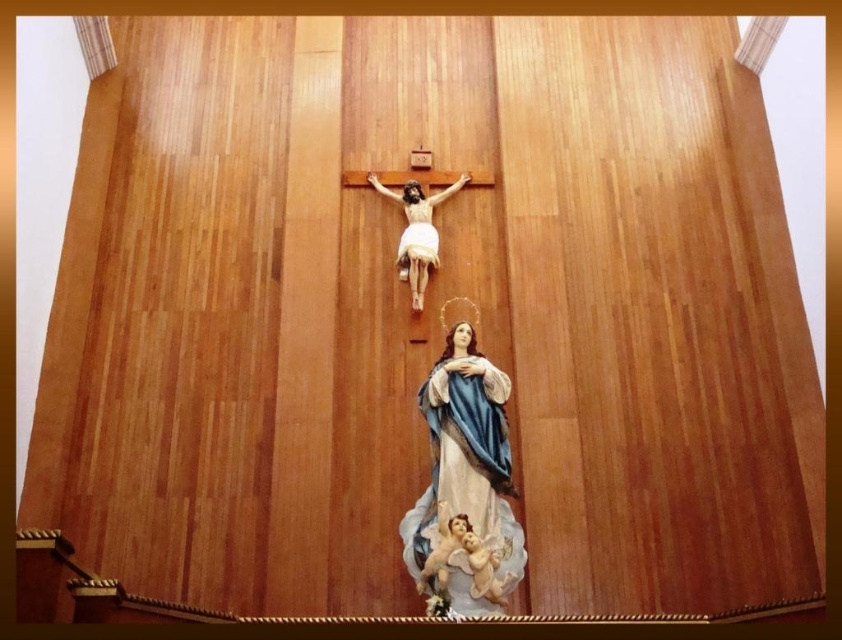
Based on the photo, between polychrome painted statue at center and smooth beige cherub at lower center, which one is positioned lower?

smooth beige cherub at lower center is below.

Who is higher up, polychrome painted statue at center or smooth beige cherub at lower center?

polychrome painted statue at center is above.

Who is more forward, (518, 580) or (514, 576)?

Point (514, 576)

What are the coordinates of `polychrome painted statue at center` in the screenshot? It's located at (465, 484).

Between polychrome painted statue at center and matte white figure at center, which one has more height?

With more height is polychrome painted statue at center.

Who is positioned more to the right, polychrome painted statue at center or matte white figure at center?

Positioned to the right is polychrome painted statue at center.

This screenshot has height=640, width=842. Find the location of `polychrome painted statue at center`. polychrome painted statue at center is located at coordinates (465, 484).

Is polychrome painted statue at center positioned in front of porcelain cherub at lower center?

That is True.

Can you confirm if polychrome painted statue at center is thinner than porcelain cherub at lower center?

No.

What do you see at coordinates (465, 484) in the screenshot?
I see `polychrome painted statue at center` at bounding box center [465, 484].

The image size is (842, 640). I want to click on polychrome painted statue at center, so click(x=465, y=484).